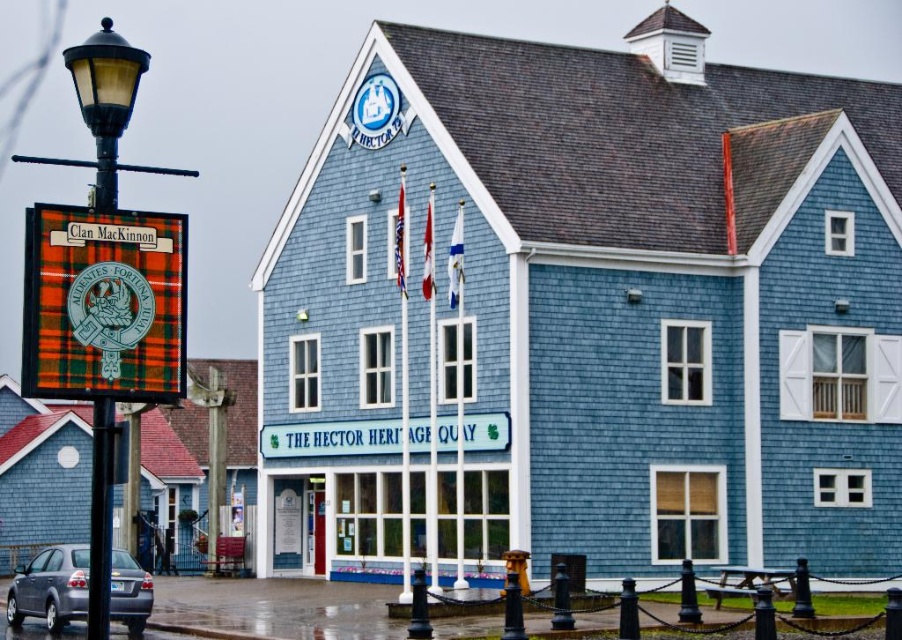
Question: Which object appears farthest from the camera in this image?

Choices:
 (A) blue wooden building at center
 (B) black metal pole at left

Answer: (A)

Question: Observing the image, what is the correct spatial positioning of blue wooden building at center in reference to plaid fabric sign at left?

Choices:
 (A) below
 (B) above

Answer: (A)

Question: Is black metal pole at left closer to camera compared to plaid fabric sign at left?

Choices:
 (A) yes
 (B) no

Answer: (A)

Question: Is blue wooden building at center bigger than black metal pole at left?

Choices:
 (A) yes
 (B) no

Answer: (A)

Question: Estimate the real-world distances between objects in this image. Which object is closer to the plaid fabric sign at left?

Choices:
 (A) plaid fabric clan mackinnon sign at left
 (B) black metal pole at left

Answer: (B)

Question: Based on their relative distances, which object is nearer to the metallic gray sedan at lower left?

Choices:
 (A) black metal pole at left
 (B) matte black lamp post at left

Answer: (A)